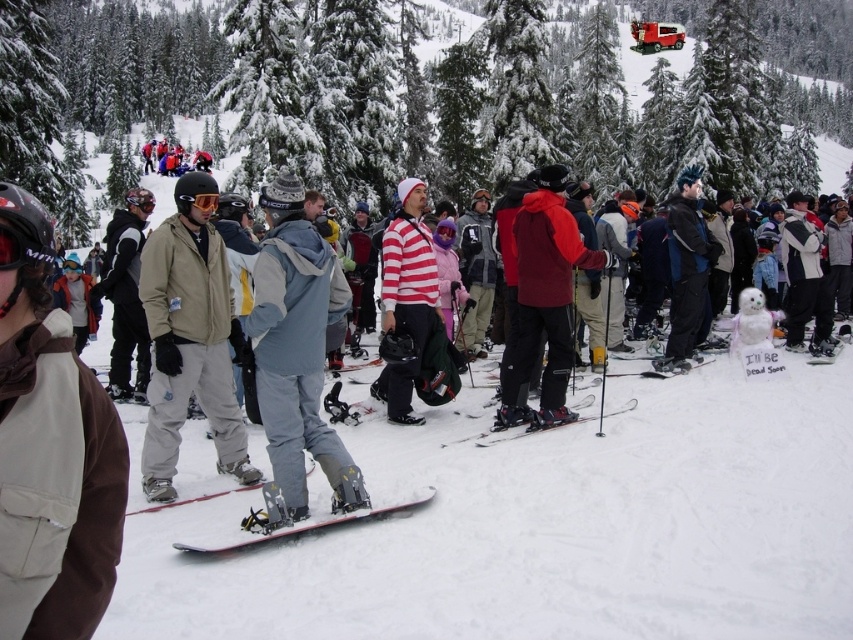
You are a photographer trying to capture both the green textured snowboard at center and the matte gray snowboard at center in a single shot. Since you want to highlight the height difference between them, which snowboard should you position closer to the camera to make it appear taller?

The green textured snowboard at center is taller than the matte gray snowboard at center. To emphasize its height, position the green textured snowboard at center closer to the camera so that it appears larger in the photo.

You are a photographer trying to capture the green textured snowboard at center in your shot. Based on its coordinates, where should you aim your camera?

The green textured snowboard at center is located at coordinates point (398,99), so aim your camera towards that position.